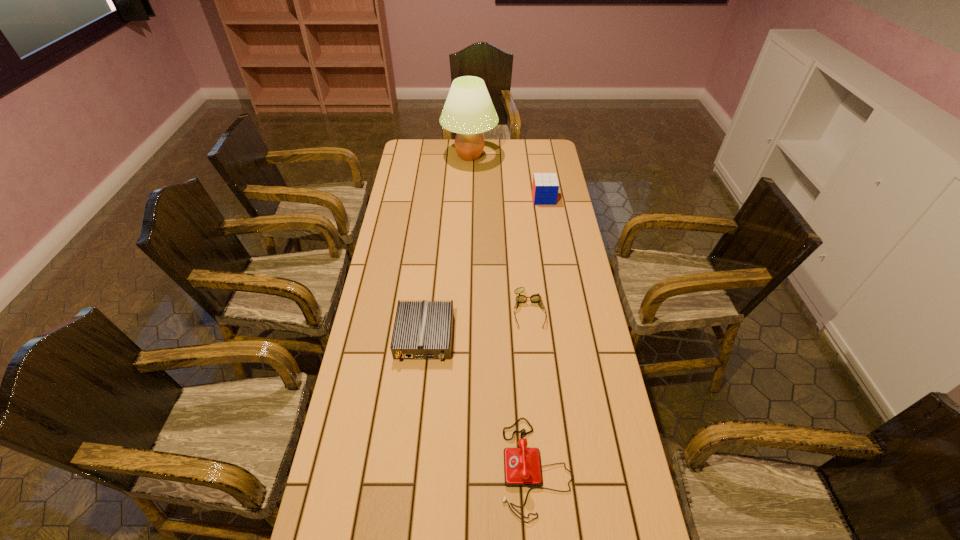
This screenshot has width=960, height=540. In the image, there is a desktop. Find the location of `vacant space at the left edge`. vacant space at the left edge is located at coordinates (399, 400).

I want to click on blank space at the right edge, so click(586, 311).

You are a GUI agent. You are given a task and a screenshot of the screen. Output one action in this format:
    pyautogui.click(x=<x>, y=<y>)
    Task: Click on the vacant area between the cube and the telephone
    The height and width of the screenshot is (540, 960).
    Given the screenshot: What is the action you would take?
    pos(540,333)

This screenshot has height=540, width=960. What are the coordinates of `empty space that is in between the shortest object and the router` in the screenshot? It's located at (477, 323).

Identify the location of free space between the nearest object and the router. point(480,402).

This screenshot has width=960, height=540. I want to click on free area in between the fourth nearest object and the shortest object, so click(537, 254).

The width and height of the screenshot is (960, 540). I want to click on empty space between the nearest object and the farthest object, so click(503, 312).

Where is `free area in between the cube and the tallest object`? free area in between the cube and the tallest object is located at coordinates (507, 177).

I want to click on free space that is in between the farthest object and the cube, so click(507, 177).

This screenshot has height=540, width=960. Identify the location of empty space between the nearest object and the shortest object. (533, 389).